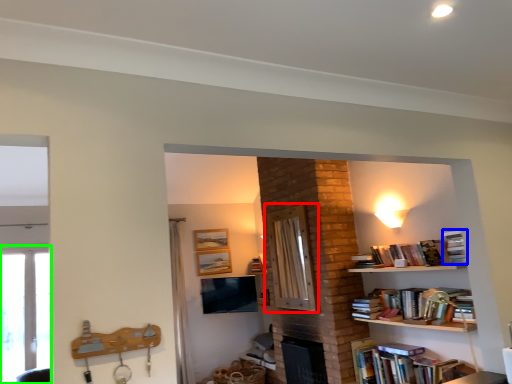
Question: Which object is the closest to the screen door (highlighted by a red box)? Choose among these: book (highlighted by a blue box) or window (highlighted by a green box).

Choices:
 (A) book
 (B) window

Answer: (A)